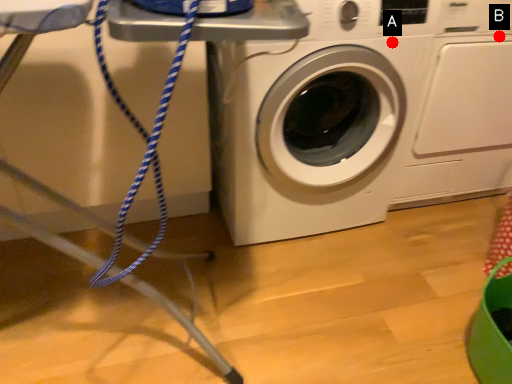
Question: Two points are circled on the image, labeled by A and B beside each circle. Which point is closer to the camera?

Choices:
 (A) A is closer
 (B) B is closer

Answer: (A)